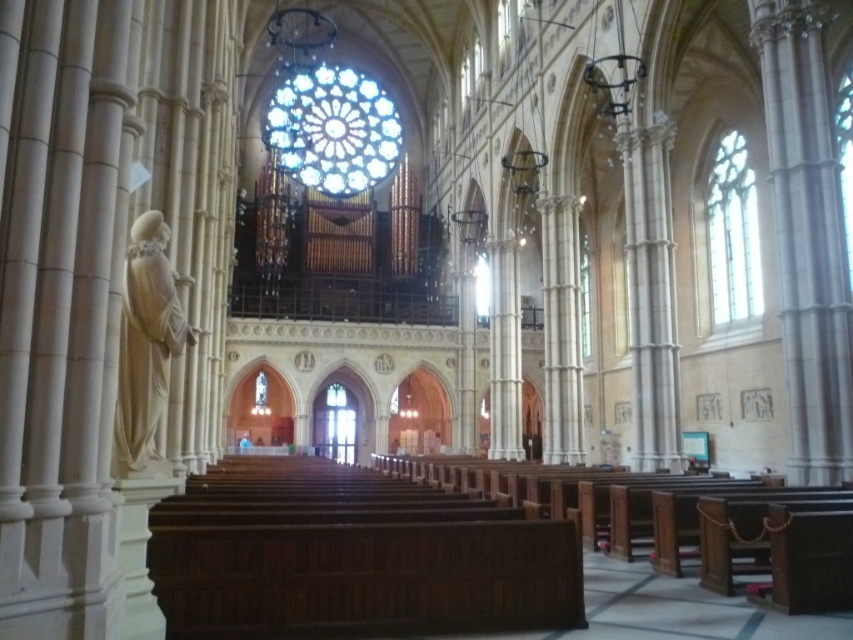
Based on the photo, you are standing inside the grand cathedral and looking at two points marked in the image. The first point is at coordinates point [379,122] and the second is at point [724,202]. Which point is closer to you?

Point [379,122] is further to the camera than point [724,202], so the point closer to you is point [724,202].

You are an architect designing a new cathedral and want to ensure proper lighting. Given the stained glass window at center and the clear glass window at right, which window allows more natural light into the cathedral?

The clear glass window at right allows more natural light into the cathedral because stained glass windows typically filter and reduce the amount of light passing through compared to clear glass. However, the stained glass window at center has a greater height, which might contribute to more light intake despite the filtering effect. The exact amount depends on factors like window area and transparency, but clear glass generally admits more light.